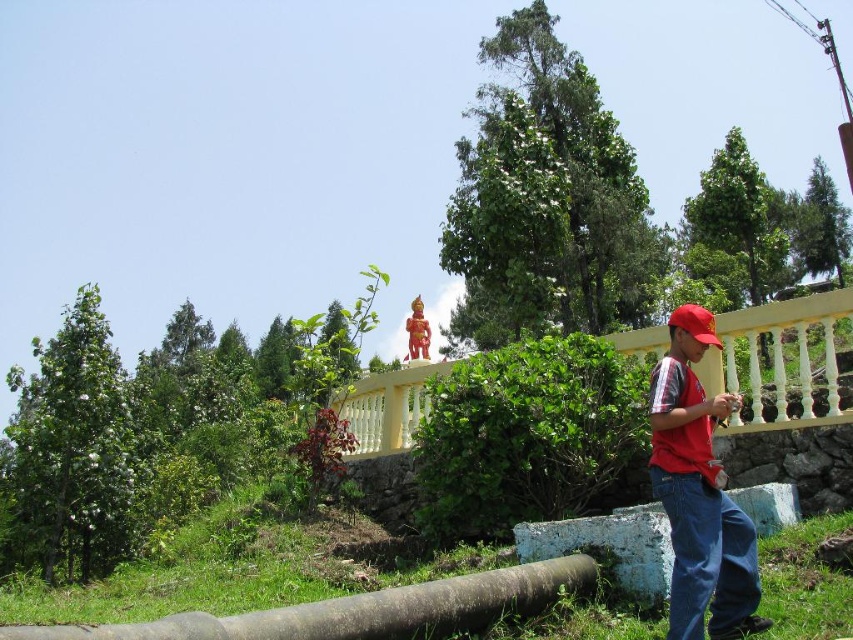
Which of these two, red matte shirt at right or brown rubber log at lower center, stands taller?

red matte shirt at right

Who is positioned more to the right, red matte shirt at right or brown rubber log at lower center?

red matte shirt at right is more to the right.

The image size is (853, 640). In order to click on red matte shirt at right in this screenshot , I will do `click(699, 492)`.

Which is more to the left, red matte shirt at right or yellow painted wood at upper center?

red matte shirt at right is more to the left.

Which is behind, point (747, 628) or point (792, 387)?

The point (792, 387) is behind.

Who is more forward, (683, 520) or (813, 292)?

Positioned in front is point (683, 520).

Where is `red matte shirt at right`? red matte shirt at right is located at coordinates (699, 492).

Which is above, yellow painted wood at upper center or brown rubber log at lower center?

yellow painted wood at upper center is above.

Is yellow painted wood at upper center positioned behind brown rubber log at lower center?

Yes.

Between point (776, 410) and point (279, 636), which one is positioned behind?

The point (776, 410) is more distant.

Locate an element on the screen. The image size is (853, 640). yellow painted wood at upper center is located at coordinates (781, 360).